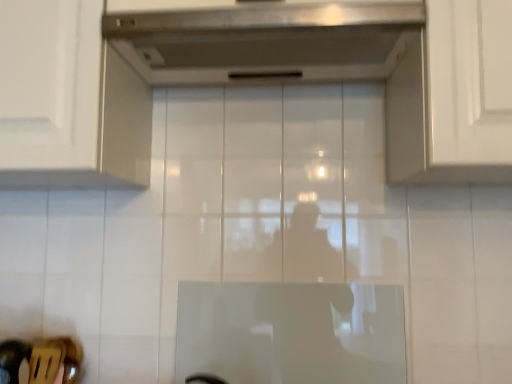
What do you see at coordinates (261, 39) in the screenshot? Image resolution: width=512 pixels, height=384 pixels. I see `stainless steel exhaust hood at upper center` at bounding box center [261, 39].

Locate an element on the screen. This screenshot has height=384, width=512. stainless steel exhaust hood at upper center is located at coordinates (261, 39).

Locate an element on the screen. This screenshot has width=512, height=384. stainless steel exhaust hood at upper center is located at coordinates (261, 39).